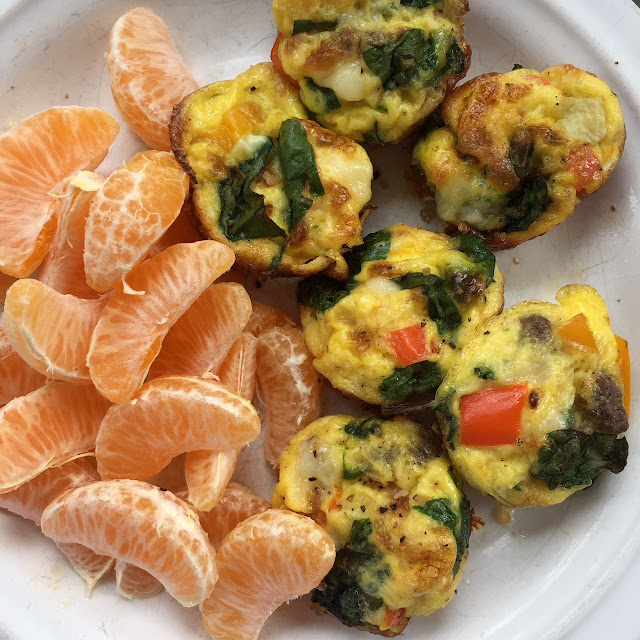
I want to click on white plate, so point(495,589).